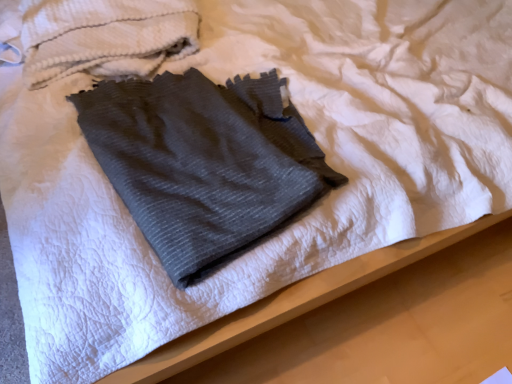
This screenshot has width=512, height=384. Find the location of `white textured towel at upper left, positioned as the 1th towel in top-to-bottom order`. white textured towel at upper left, positioned as the 1th towel in top-to-bottom order is located at coordinates (96, 36).

Describe the element at coordinates (96, 36) in the screenshot. I see `white textured towel at upper left, the 2th towel from the bottom` at that location.

In order to face gray ribbed towel at center, the first towel from the bottom, should I rotate leftwards or rightwards?

Turn left approximately 5.462 degrees to face it.

I want to click on gray ribbed towel at center, the second towel positioned from the top, so click(x=204, y=163).

What do you see at coordinates (204, 163) in the screenshot?
I see `gray ribbed towel at center, the second towel positioned from the top` at bounding box center [204, 163].

Where is `white textured towel at upper left, positioned as the 1th towel in top-to-bottom order`? white textured towel at upper left, positioned as the 1th towel in top-to-bottom order is located at coordinates (96, 36).

Which is more to the right, white textured towel at upper left, the 2th towel from the bottom, or gray ribbed towel at center, the second towel positioned from the top?

gray ribbed towel at center, the second towel positioned from the top.

Considering their positions, is white textured towel at upper left, positioned as the 1th towel in top-to-bottom order, located in front of or behind gray ribbed towel at center, the first towel from the bottom?

Clearly, white textured towel at upper left, positioned as the 1th towel in top-to-bottom order, is behind gray ribbed towel at center, the first towel from the bottom.

Does point (37, 5) come closer to viewer compared to point (255, 170)?

No.

From the image's perspective, is white textured towel at upper left, the 2th towel from the bottom, above gray ribbed towel at center, the first towel from the bottom?

Yes, from the image's perspective, white textured towel at upper left, the 2th towel from the bottom, is on top of gray ribbed towel at center, the first towel from the bottom.

From a real-world perspective, who is located higher, white textured towel at upper left, the 2th towel from the bottom, or gray ribbed towel at center, the second towel positioned from the top?

In real-world perspective, white textured towel at upper left, the 2th towel from the bottom, is above.

Between white textured towel at upper left, positioned as the 1th towel in top-to-bottom order, and gray ribbed towel at center, the first towel from the bottom, which one has smaller width?

Thinner between the two is gray ribbed towel at center, the first towel from the bottom.

Does white textured towel at upper left, the 2th towel from the bottom, have a greater height compared to gray ribbed towel at center, the second towel positioned from the top?

Correct, white textured towel at upper left, the 2th towel from the bottom, is much taller as gray ribbed towel at center, the second towel positioned from the top.

Is white textured towel at upper left, positioned as the 1th towel in top-to-bottom order, smaller than gray ribbed towel at center, the second towel positioned from the top?

Yes, white textured towel at upper left, positioned as the 1th towel in top-to-bottom order, is smaller than gray ribbed towel at center, the second towel positioned from the top.

Can gray ribbed towel at center, the second towel positioned from the top, be found inside white textured towel at upper left, the 2th towel from the bottom?

Definitely not — gray ribbed towel at center, the second towel positioned from the top, is not inside white textured towel at upper left, the 2th towel from the bottom.

In the scene shown: Is white textured towel at upper left, the 2th towel from the bottom, next to gray ribbed towel at center, the second towel positioned from the top, and touching it?

No, white textured towel at upper left, the 2th towel from the bottom, is not next to gray ribbed towel at center, the second towel positioned from the top.

Could you tell me if white textured towel at upper left, positioned as the 1th towel in top-to-bottom order, is facing gray ribbed towel at center, the second towel positioned from the top?

No, white textured towel at upper left, positioned as the 1th towel in top-to-bottom order, does not turn towards gray ribbed towel at center, the second towel positioned from the top.

Can you tell me how much white textured towel at upper left, the 2th towel from the bottom, and gray ribbed towel at center, the first towel from the bottom, differ in facing direction?

The facing directions of white textured towel at upper left, the 2th towel from the bottom, and gray ribbed towel at center, the first towel from the bottom, are 20.4 degrees apart.

Locate an element on the screen. Image resolution: width=512 pixels, height=384 pixels. towel on the right side of white textured towel at upper left, positioned as the 1th towel in top-to-bottom order is located at coordinates (204, 163).

Between gray ribbed towel at center, the first towel from the bottom, and white textured towel at upper left, positioned as the 1th towel in top-to-bottom order, which one appears on the left side from the viewer's perspective?

white textured towel at upper left, positioned as the 1th towel in top-to-bottom order.

Which object is closer to the camera taking this photo, gray ribbed towel at center, the second towel positioned from the top, or white textured towel at upper left, the 2th towel from the bottom?

gray ribbed towel at center, the second towel positioned from the top, is more forward.

Between point (223, 174) and point (113, 44), which one is positioned in front?

The point (223, 174) is closer to the camera.

From the image's perspective, which is below, gray ribbed towel at center, the second towel positioned from the top, or white textured towel at upper left, positioned as the 1th towel in top-to-bottom order?

gray ribbed towel at center, the second towel positioned from the top.

From a real-world perspective, is gray ribbed towel at center, the first towel from the bottom, under white textured towel at upper left, the 2th towel from the bottom?

Yes.

Which object is thinner, gray ribbed towel at center, the first towel from the bottom, or white textured towel at upper left, the 2th towel from the bottom?

gray ribbed towel at center, the first towel from the bottom, is thinner.

Between gray ribbed towel at center, the second towel positioned from the top, and white textured towel at upper left, positioned as the 1th towel in top-to-bottom order, which one has more height?

white textured towel at upper left, positioned as the 1th towel in top-to-bottom order, is taller.

Is gray ribbed towel at center, the first towel from the bottom, smaller than white textured towel at upper left, positioned as the 1th towel in top-to-bottom order?

No.

Is gray ribbed towel at center, the second towel positioned from the top, outside of white textured towel at upper left, positioned as the 1th towel in top-to-bottom order?

Indeed, gray ribbed towel at center, the second towel positioned from the top, is completely outside white textured towel at upper left, positioned as the 1th towel in top-to-bottom order.

Is gray ribbed towel at center, the second towel positioned from the top, far from white textured towel at upper left, positioned as the 1th towel in top-to-bottom order?

That's not correct — gray ribbed towel at center, the second towel positioned from the top, is a little close to white textured towel at upper left, positioned as the 1th towel in top-to-bottom order.

Does gray ribbed towel at center, the first towel from the bottom, turn towards white textured towel at upper left, the 2th towel from the bottom?

No.

There is a gray ribbed towel at center, the first towel from the bottom. Identify the location of towel above it (from a real-world perspective). (96, 36).

I want to click on towel below the white textured towel at upper left, positioned as the 1th towel in top-to-bottom order (from a real-world perspective), so click(x=204, y=163).

Locate an element on the screen. This screenshot has height=384, width=512. towel lying on the left of gray ribbed towel at center, the first towel from the bottom is located at coordinates (96, 36).